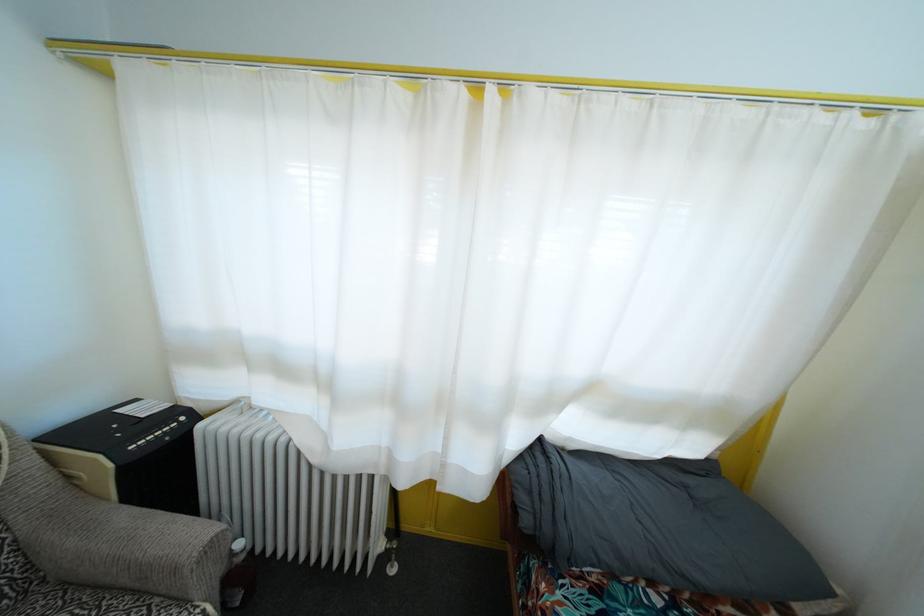
Describe the element at coordinates (73, 476) in the screenshot. I see `a machine paper slot` at that location.